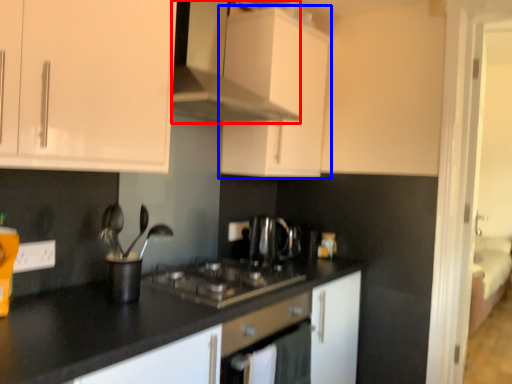
Question: Which object appears closest to the camera in this image, cabinetry (highlighted by a red box) or cabinetry (highlighted by a blue box)?

Choices:
 (A) cabinetry
 (B) cabinetry

Answer: (A)